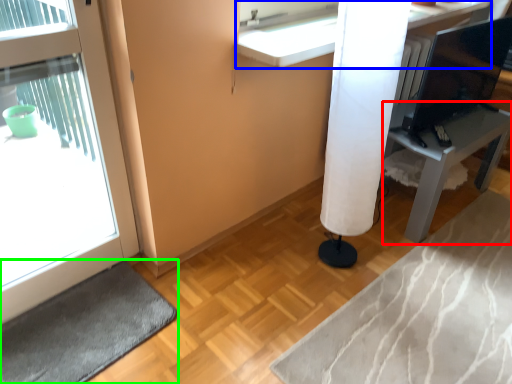
Question: Which object is positioned farthest from furniture (highlighted by a red box)? Select from counter (highlighted by a blue box) and bath mat (highlighted by a green box).

Choices:
 (A) counter
 (B) bath mat

Answer: (B)